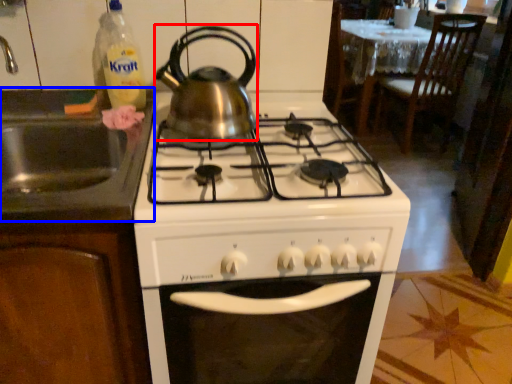
Question: Among these objects, which one is nearest to the camera, kitchen appliance (highlighted by a red box) or sink (highlighted by a blue box)?

Choices:
 (A) kitchen appliance
 (B) sink

Answer: (B)